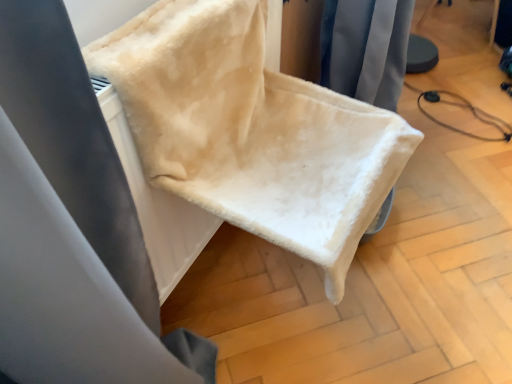
Question: Is white fleece blanket at center in front of beige fleece blanket at upper left?

Choices:
 (A) yes
 (B) no

Answer: (A)

Question: Is white fleece blanket at center outside of beige fleece blanket at upper left?

Choices:
 (A) no
 (B) yes

Answer: (B)

Question: Is white fleece blanket at center at the left side of beige fleece blanket at upper left?

Choices:
 (A) yes
 (B) no

Answer: (B)

Question: Is white fleece blanket at center taller than beige fleece blanket at upper left?

Choices:
 (A) no
 (B) yes

Answer: (A)

Question: Is white fleece blanket at center to the right of beige fleece blanket at upper left from the viewer's perspective?

Choices:
 (A) yes
 (B) no

Answer: (A)

Question: Considering the relative sizes of white fleece blanket at center and beige fleece blanket at upper left in the image provided, is white fleece blanket at center shorter than beige fleece blanket at upper left?

Choices:
 (A) yes
 (B) no

Answer: (A)

Question: Can you confirm if beige fleece blanket at upper left is thinner than white fleece blanket at center?

Choices:
 (A) yes
 (B) no

Answer: (A)

Question: Can you confirm if beige fleece blanket at upper left is taller than white fleece blanket at center?

Choices:
 (A) no
 (B) yes

Answer: (B)

Question: From a real-world perspective, is beige fleece blanket at upper left beneath white fleece blanket at center?

Choices:
 (A) yes
 (B) no

Answer: (A)

Question: Is beige fleece blanket at upper left bigger than white fleece blanket at center?

Choices:
 (A) yes
 (B) no

Answer: (B)

Question: Considering the relative positions of beige fleece blanket at upper left and white fleece blanket at center in the image provided, is beige fleece blanket at upper left in front of white fleece blanket at center?

Choices:
 (A) no
 (B) yes

Answer: (A)

Question: Is beige fleece blanket at upper left at the right side of white fleece blanket at center?

Choices:
 (A) no
 (B) yes

Answer: (A)

Question: Looking at the image, does beige fleece blanket at upper left seem bigger or smaller compared to white fleece blanket at center?

Choices:
 (A) big
 (B) small

Answer: (B)